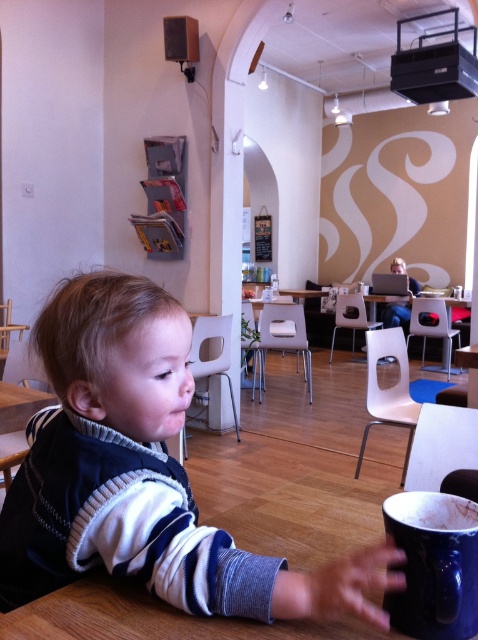
Does dark blue sweater at center appear on the right side of blue ceramic mug at lower right?

No, dark blue sweater at center is not to the right of blue ceramic mug at lower right.

Who is shorter, dark blue sweater at center or blue ceramic mug at lower right?

Standing shorter between the two is blue ceramic mug at lower right.

Describe the element at coordinates (142, 474) in the screenshot. This screenshot has width=478, height=640. I see `dark blue sweater at center` at that location.

I want to click on dark blue sweater at center, so click(x=142, y=474).